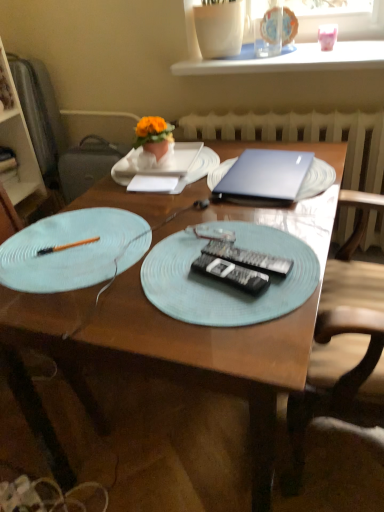
What are the coordinates of `vacant area located to the right-hand side of black plastic remote control at center, placed as the 2th remote control when sorted from bottom to top` in the screenshot? It's located at (299, 248).